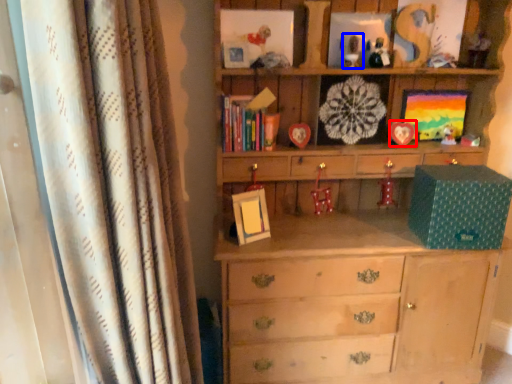
Question: Which object appears farthest to the camera in this image, picture frame (highlighted by a red box) or toy (highlighted by a blue box)?

Choices:
 (A) picture frame
 (B) toy

Answer: (A)